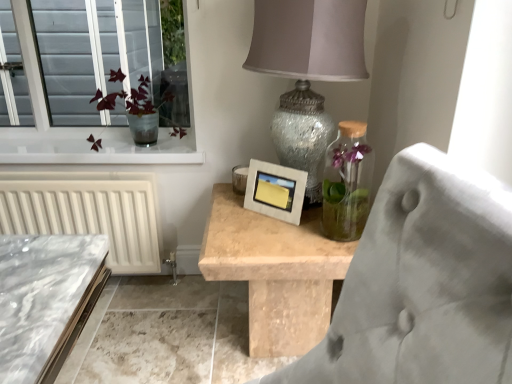
Question: From the image's perspective, does translucent glass vase at upper left appear lower than speckled glass lampshade at upper center?

Choices:
 (A) yes
 (B) no

Answer: (B)

Question: Does translucent glass vase at upper left have a greater height compared to speckled glass lampshade at upper center?

Choices:
 (A) yes
 (B) no

Answer: (B)

Question: From the image's perspective, would you say translucent glass vase at upper left is positioned over speckled glass lampshade at upper center?

Choices:
 (A) yes
 (B) no

Answer: (A)

Question: Is translucent glass vase at upper left in front of speckled glass lampshade at upper center?

Choices:
 (A) yes
 (B) no

Answer: (B)

Question: Considering the relative sizes of translucent glass vase at upper left and speckled glass lampshade at upper center in the image provided, is translucent glass vase at upper left smaller than speckled glass lampshade at upper center?

Choices:
 (A) no
 (B) yes

Answer: (B)

Question: Is translucent glass vase at upper left oriented away from speckled glass lampshade at upper center?

Choices:
 (A) no
 (B) yes

Answer: (A)

Question: From a real-world perspective, is speckled glass lampshade at upper center located higher than matte concrete picture frame at center?

Choices:
 (A) no
 (B) yes

Answer: (B)

Question: Does speckled glass lampshade at upper center appear on the right side of matte concrete picture frame at center?

Choices:
 (A) yes
 (B) no

Answer: (A)

Question: Considering the relative sizes of speckled glass lampshade at upper center and matte concrete picture frame at center in the image provided, is speckled glass lampshade at upper center wider than matte concrete picture frame at center?

Choices:
 (A) yes
 (B) no

Answer: (A)

Question: Is speckled glass lampshade at upper center looking in the opposite direction of matte concrete picture frame at center?

Choices:
 (A) no
 (B) yes

Answer: (A)

Question: Are speckled glass lampshade at upper center and matte concrete picture frame at center making contact?

Choices:
 (A) yes
 (B) no

Answer: (B)

Question: From the image's perspective, is speckled glass lampshade at upper center under matte concrete picture frame at center?

Choices:
 (A) no
 (B) yes

Answer: (A)

Question: From a real-world perspective, is matte concrete picture frame at center located beneath translucent glass vase at upper left?

Choices:
 (A) no
 (B) yes

Answer: (B)